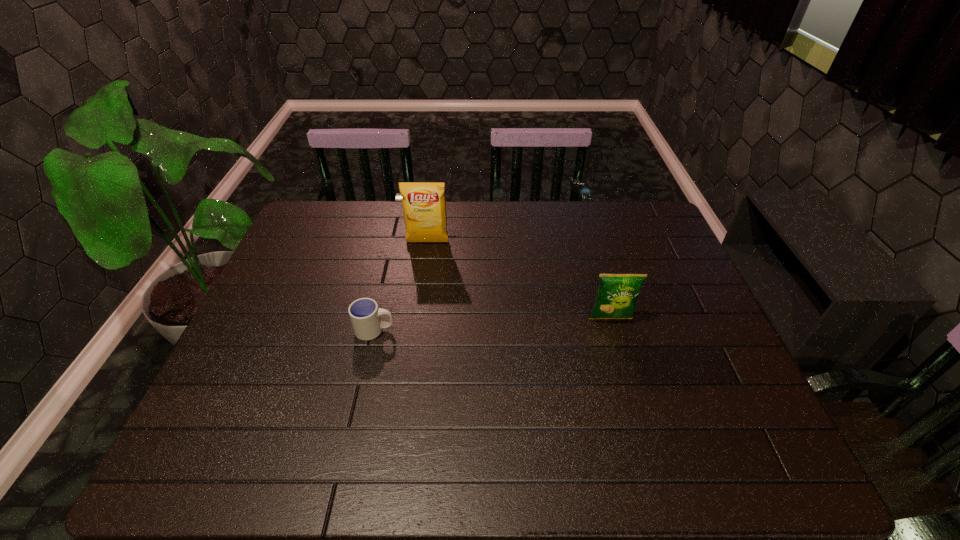
The width and height of the screenshot is (960, 540). I want to click on free spot at the near edge of the desktop, so click(x=544, y=444).

Find the location of a particular element. vacant space at the left edge of the desktop is located at coordinates (294, 322).

The height and width of the screenshot is (540, 960). In the image, there is a desktop. In order to click on blank space at the right edge in this screenshot , I will do `click(638, 260)`.

This screenshot has width=960, height=540. Find the location of `free region at the far left corner`. free region at the far left corner is located at coordinates coord(325,203).

You are a GUI agent. You are given a task and a screenshot of the screen. Output one action in this format:
    pyautogui.click(x=<x>, y=<y>)
    Task: Click on the empty space between the left crisp (potato chip) and the shortest object
    This screenshot has height=540, width=960.
    Given the screenshot: What is the action you would take?
    pyautogui.click(x=401, y=286)

Locate an element on the screen. The height and width of the screenshot is (540, 960). free space that is in between the cup and the farthest object is located at coordinates (401, 286).

At what (x,y) coordinates should I click in order to perform the action: click on vacant area that lies between the shorter crisp (potato chip) and the cup. Please return your answer as a coordinate pair (x, y). The width and height of the screenshot is (960, 540). Looking at the image, I should click on (492, 325).

Find the location of a particular element. The width and height of the screenshot is (960, 540). empty location between the cup and the rightmost object is located at coordinates (492, 325).

You are a GUI agent. You are given a task and a screenshot of the screen. Output one action in this format:
    pyautogui.click(x=<x>, y=<y>)
    Task: Click on the free space that is in between the farther crisp (potato chip) and the nearer crisp (potato chip)
    The width and height of the screenshot is (960, 540).
    Given the screenshot: What is the action you would take?
    pyautogui.click(x=519, y=280)

Find the location of `free area in between the cup and the shorter crisp (potato chip)`. free area in between the cup and the shorter crisp (potato chip) is located at coordinates (492, 325).